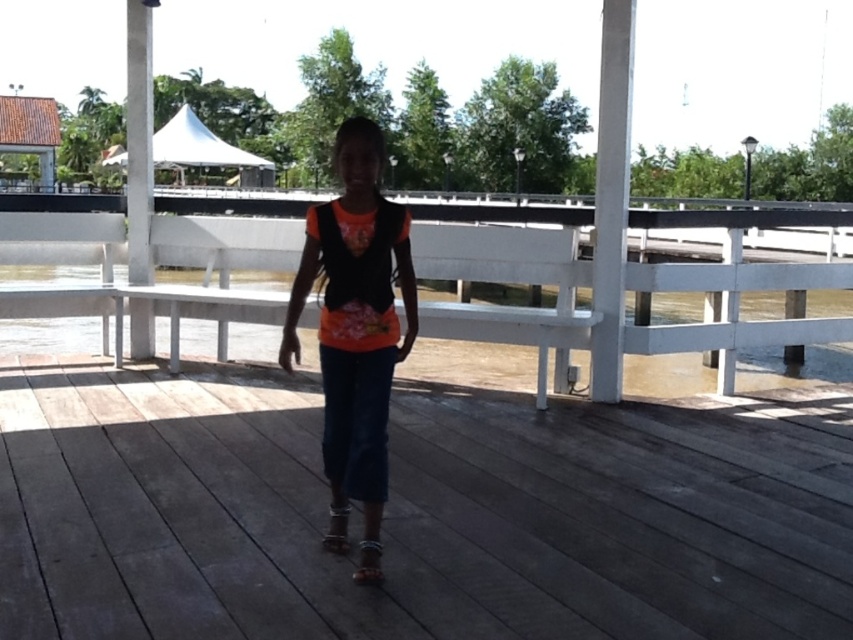
You are standing at the point with coordinates (x=416, y=513) in the image. What object are you standing on?

You are standing on the brown wooden deck at center located at point (x=416, y=513).

You are a delivery person trying to reach the white wooden porch at center from the brown wooden deck at center. Based on the scene, which object is lower in height and might require a step up to reach the porch?

The brown wooden deck at center has a lesser height compared to the white wooden porch at center, so you would need to step up from the brown wooden deck at center to reach the white wooden porch at center.